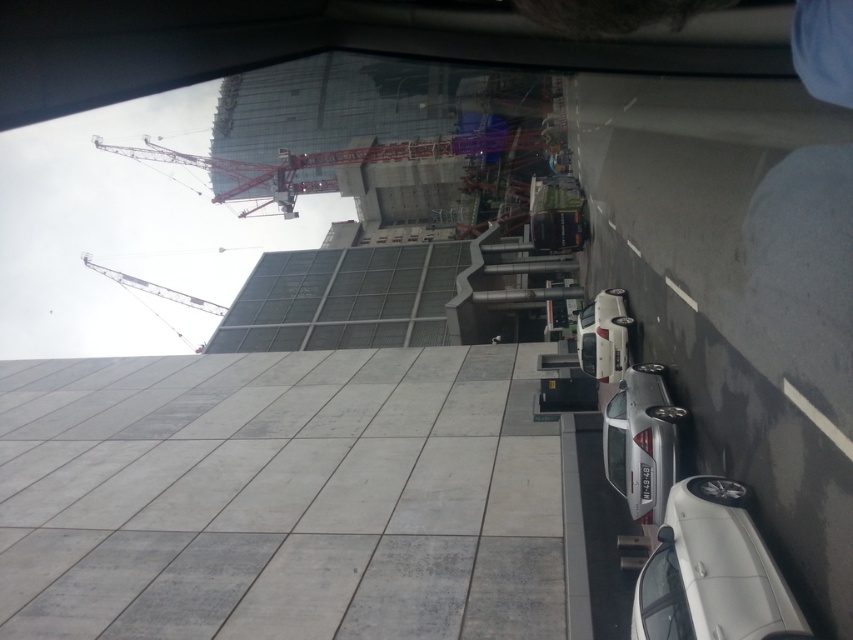
Does point (292, 180) come closer to viewer compared to point (194, 307)?

Yes.

In the scene shown: Which of these two, red metal crane at upper center or metallic gray crane at upper left, stands shorter?

red metal crane at upper center

Identify the location of red metal crane at upper center. Image resolution: width=853 pixels, height=640 pixels. (326, 163).